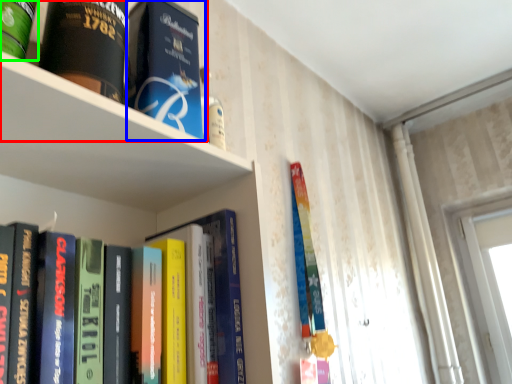
Question: Estimate the real-world distances between objects in this image. Which object is closer to book (highlighted by a red box), book (highlighted by a blue box) or book (highlighted by a green box)?

Choices:
 (A) book
 (B) book

Answer: (A)